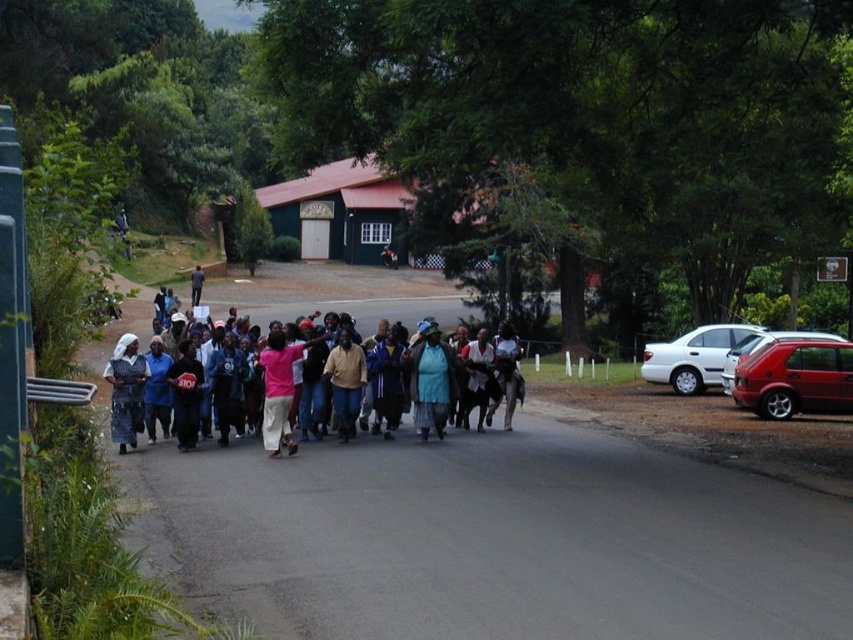
You are standing at the point with coordinates (x=693, y=356) in the image. What object is located at this point?

The white matte sedan at right is located at point (x=693, y=356).

You are a photographer at the event and want to capture both the matte black dress at center and the pink fabric at center in the same frame. Which object should you position to the left in your camera viewfinder to ensure both are included?

To include both the matte black dress at center and the pink fabric at center in the same frame, position the matte black dress at center to the left side of the pink fabric at center in your camera viewfinder, as it is already naturally positioned that way.

You are a delivery driver who needs to park your vehicle 20 meters away from the current scene. The metallic red hatchback at right is already parked here. Can you park your vehicle behind it without exceeding the 20 meters limit?

The metallic red hatchback at right is 18.31 meters away from the camera. If you park behind it, the total distance would be more than 18.31 meters, but since the requirement is to park 20 meters away, parking behind it would exceed the limit. Therefore, you cannot park behind the metallic red hatchback at right and stay within the 20 meters limit.